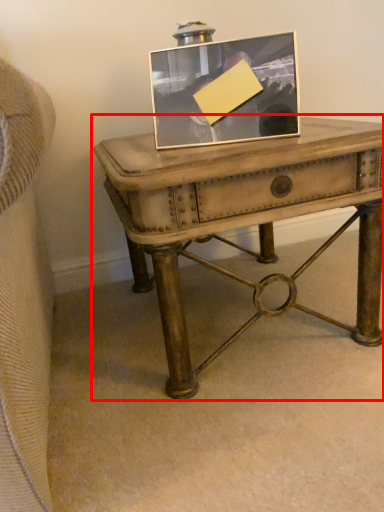
Question: From the image's perspective, what is the correct spatial relationship of table (annotated by the red box) in relation to picture frame?

Choices:
 (A) below
 (B) above

Answer: (A)